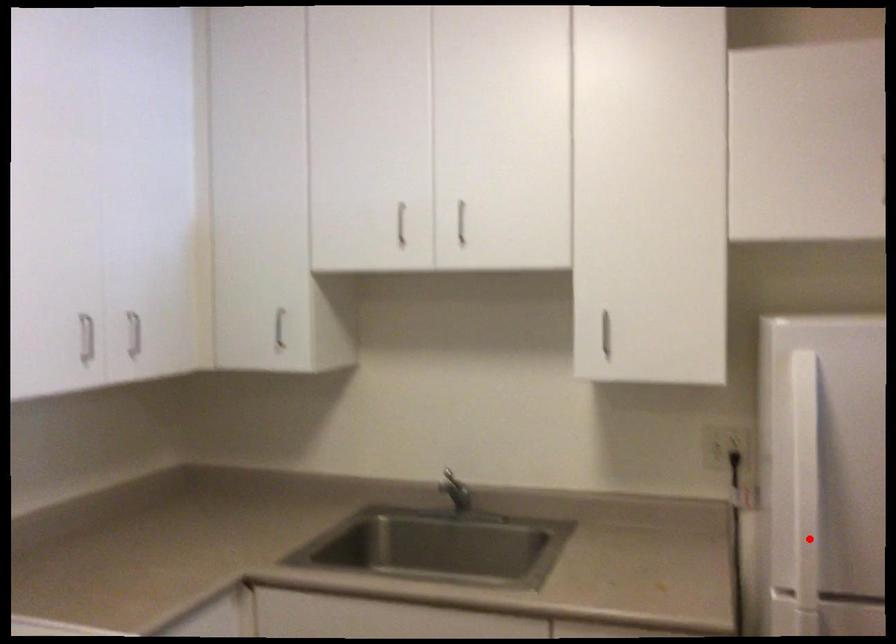
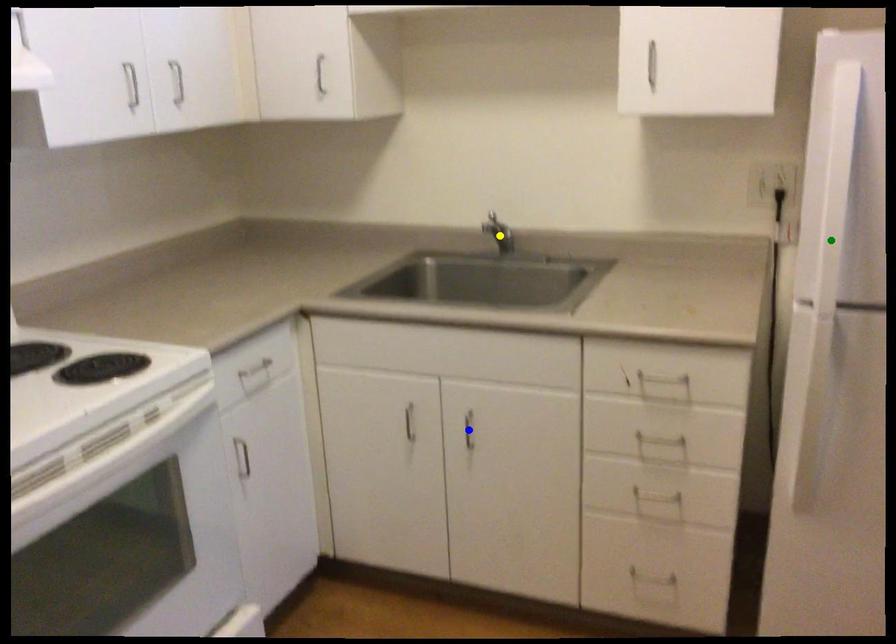
Question: I am providing you with two images of the same scene from different viewpoints. A red point is marked on the first image. You are given multiple points on the second image. Which mark in image 2 goes with the point in image 1?

Choices:
 (A) yellow point
 (B) green point
 (C) blue point

Answer: (B)